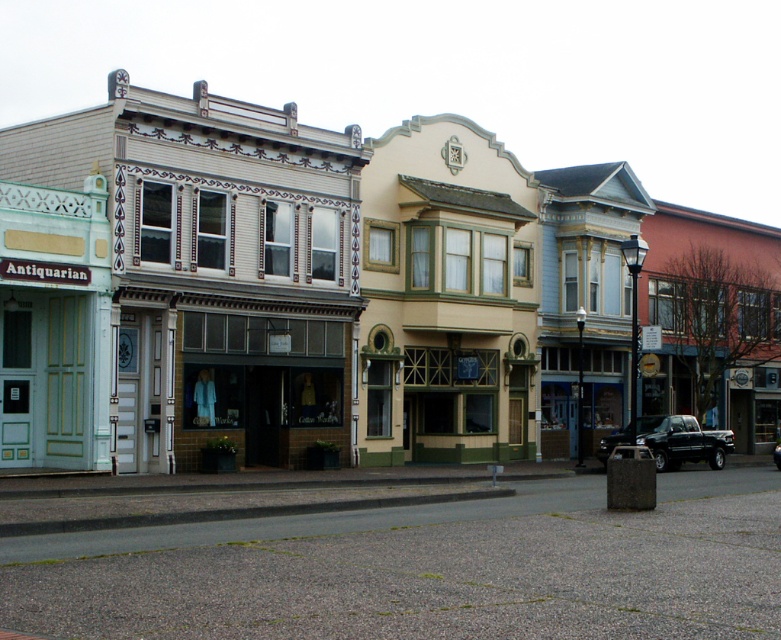
Which is above, matte white building at center or black glossy truck at center?

matte white building at center

Which is in front, point (475, 362) or point (776, 468)?

Point (475, 362) is more forward.

Locate an element on the screen. Image resolution: width=781 pixels, height=640 pixels. matte white building at center is located at coordinates (296, 289).

Does matte white building at center have a lesser width compared to black matte truck at lower right?

No.

Is point (446, 396) positioned before point (726, 445)?

Yes.

Measure the distance between matte white building at center and camera.

matte white building at center and camera are 22.63 meters apart from each other.

Where is `matte white building at center`? This screenshot has height=640, width=781. matte white building at center is located at coordinates (296, 289).

Is point (701, 456) less distant than point (776, 428)?

That is True.

Which is in front, point (710, 458) or point (772, 452)?

Point (710, 458)

Locate an element on the screen. black matte truck at lower right is located at coordinates (683, 440).